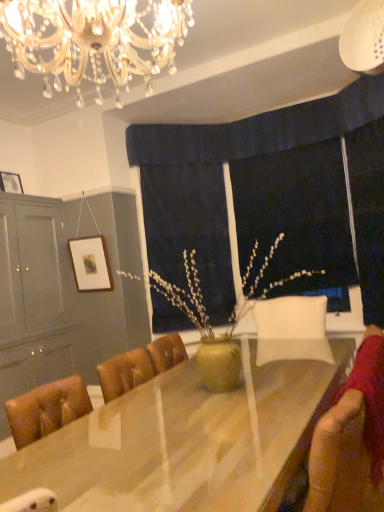
Locate an element on the screen. vacant space underneath matte yellow vase at center (from a real-world perspective) is located at coordinates (185, 395).